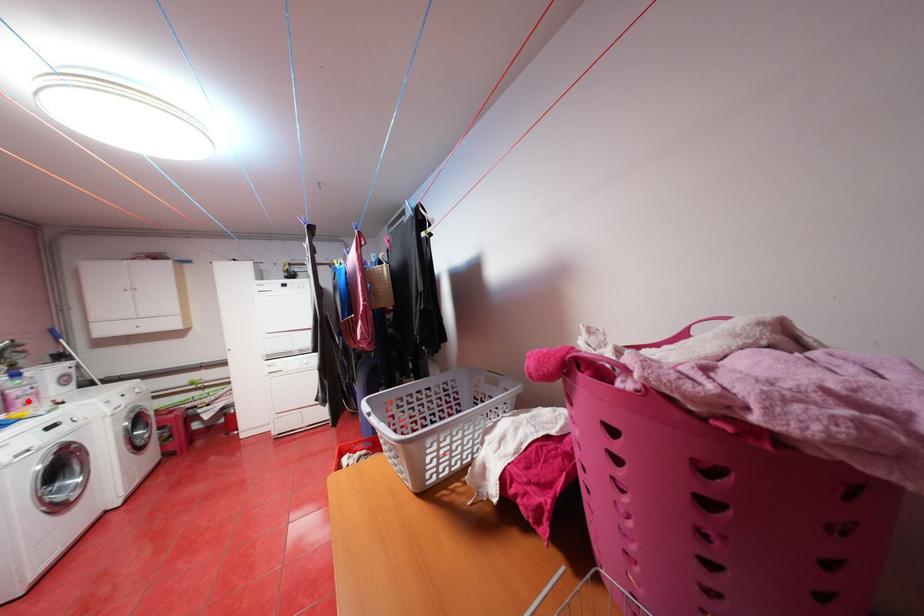
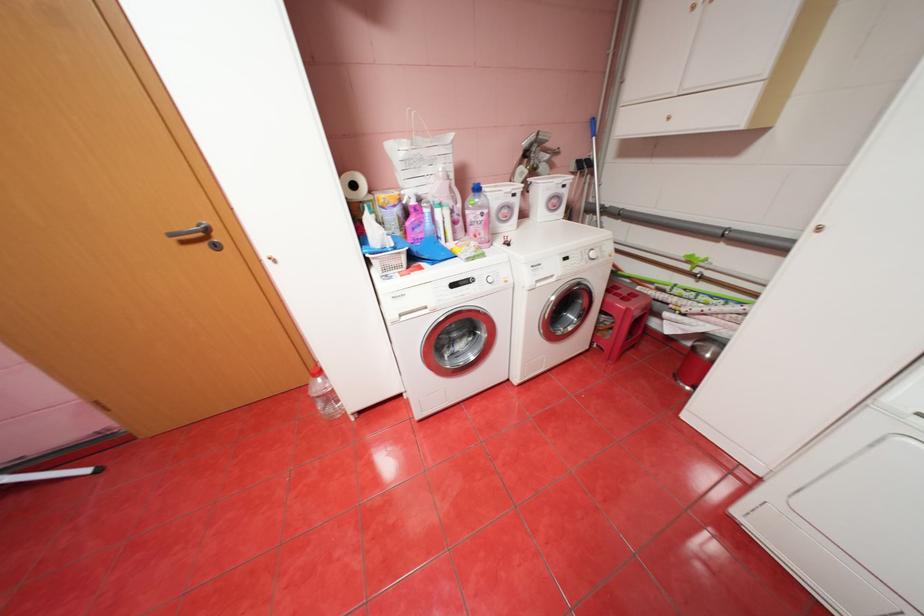
Question: I am providing you with two images of the same scene from different viewpoints. In image1, a red point is highlighted. Considering the same 3D point in image2, which of the following is correct?

Choices:
 (A) It is closer
 (B) It is farther

Answer: (A)